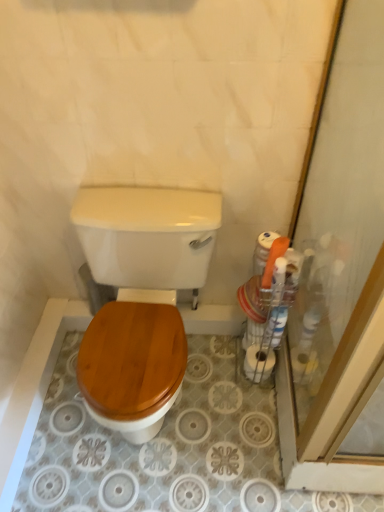
Question: Considering the relative sizes of wooden toilet seat at center and white matte toilet paper at right in the image provided, is wooden toilet seat at center bigger than white matte toilet paper at right?

Choices:
 (A) yes
 (B) no

Answer: (A)

Question: Does wooden toilet seat at center have a lesser width compared to white matte toilet paper at right?

Choices:
 (A) no
 (B) yes

Answer: (A)

Question: Does wooden toilet seat at center have a smaller size compared to white matte toilet paper at right?

Choices:
 (A) yes
 (B) no

Answer: (B)

Question: Can you confirm if wooden toilet seat at center is taller than white matte toilet paper at right?

Choices:
 (A) no
 (B) yes

Answer: (B)

Question: Can you confirm if wooden toilet seat at center is positioned to the right of white matte toilet paper at right?

Choices:
 (A) yes
 (B) no

Answer: (B)

Question: Considering the positions of wooden toilet seat at center and transparent glass screen door at right in the image, is wooden toilet seat at center wider or thinner than transparent glass screen door at right?

Choices:
 (A) thin
 (B) wide

Answer: (A)

Question: Looking at the image, does wooden toilet seat at center seem bigger or smaller compared to transparent glass screen door at right?

Choices:
 (A) small
 (B) big

Answer: (A)

Question: From a real-world perspective, relative to transparent glass screen door at right, is wooden toilet seat at center vertically above or below?

Choices:
 (A) above
 (B) below

Answer: (B)

Question: Is wooden toilet seat at center in front of or behind transparent glass screen door at right in the image?

Choices:
 (A) front
 (B) behind

Answer: (B)

Question: Is point (256, 349) closer or farther from the camera than point (314, 138)?

Choices:
 (A) closer
 (B) farther

Answer: (B)

Question: From a real-world perspective, is white matte toilet paper at right physically located above or below transparent glass screen door at right?

Choices:
 (A) above
 (B) below

Answer: (B)

Question: Is white matte toilet paper at right inside or outside of transparent glass screen door at right?

Choices:
 (A) inside
 (B) outside

Answer: (B)

Question: Is white matte toilet paper at right taller or shorter than transparent glass screen door at right?

Choices:
 (A) tall
 (B) short

Answer: (B)

Question: Looking at their shapes, would you say wooden toilet seat at center is wider or thinner than white matte toilet paper at right?

Choices:
 (A) wide
 (B) thin

Answer: (A)

Question: Is wooden toilet seat at center to the left or to the right of white matte toilet paper at right in the image?

Choices:
 (A) right
 (B) left

Answer: (B)